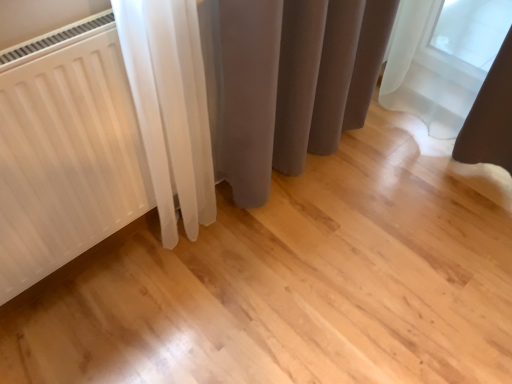
Measure the distance between point (85, 51) and camera.

The depth of point (85, 51) is 33.98 inches.

What do you see at coordinates (66, 150) in the screenshot? I see `white matte radiator at left` at bounding box center [66, 150].

Locate an element on the screen. Image resolution: width=512 pixels, height=384 pixels. white matte radiator at left is located at coordinates (66, 150).

This screenshot has width=512, height=384. I want to click on white matte radiator at left, so click(66, 150).